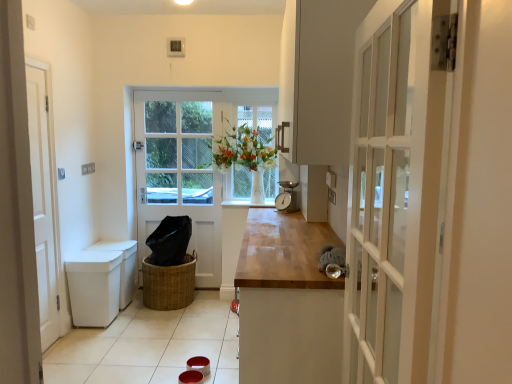
Question: Can you confirm if white glossy window sill at center is shorter than white wooden door at left, the 2th door positioned from the right?

Choices:
 (A) no
 (B) yes

Answer: (B)

Question: Is white glossy window sill at center oriented away from white wooden door at left, the 2th door positioned from the right?

Choices:
 (A) yes
 (B) no

Answer: (B)

Question: Considering the relative sizes of white glossy window sill at center and white wooden door at left, the second door viewed from the back, in the image provided, is white glossy window sill at center thinner than white wooden door at left, the second door viewed from the back,?

Choices:
 (A) yes
 (B) no

Answer: (B)

Question: Can white wooden door at left, which ranks as the first door in left-to-right order, be found inside white glossy window sill at center?

Choices:
 (A) no
 (B) yes

Answer: (A)

Question: From a real-world perspective, is white glossy window sill at center physically above white wooden door at left, which ranks as the first door in left-to-right order?

Choices:
 (A) no
 (B) yes

Answer: (A)

Question: From a real-world perspective, is white wooden door at left, the second door viewed from the back, physically located above or below white wooden door at center, the 1th door from the back?

Choices:
 (A) above
 (B) below

Answer: (A)

Question: From their relative heights in the image, would you say white wooden door at left, which ranks as the first door in left-to-right order, is taller or shorter than white wooden door at center, placed as the second door when sorted from front to back?

Choices:
 (A) tall
 (B) short

Answer: (A)

Question: Is point (68, 327) positioned closer to the camera than point (218, 119)?

Choices:
 (A) closer
 (B) farther

Answer: (A)

Question: Is white wooden door at left, the 2th door positioned from the right, wider or thinner than white wooden door at center, the 1th door from the back?

Choices:
 (A) thin
 (B) wide

Answer: (A)

Question: Considering the positions of metallic silver scale at center and woven brown basket at center in the image, is metallic silver scale at center taller or shorter than woven brown basket at center?

Choices:
 (A) short
 (B) tall

Answer: (A)

Question: Does point (288, 195) appear closer or farther from the camera than point (183, 274)?

Choices:
 (A) farther
 (B) closer

Answer: (B)

Question: Visually, is metallic silver scale at center positioned to the left or to the right of woven brown basket at center?

Choices:
 (A) left
 (B) right

Answer: (B)

Question: Considering their positions, is metallic silver scale at center located in front of or behind woven brown basket at center?

Choices:
 (A) front
 (B) behind

Answer: (A)

Question: From the image's perspective, relative to white wooden door at left, the second door viewed from the back, is clear glass window at center above or below?

Choices:
 (A) above
 (B) below

Answer: (A)

Question: Visually, is clear glass window at center positioned to the left or to the right of white wooden door at left, the 2th door positioned from the right?

Choices:
 (A) left
 (B) right

Answer: (B)